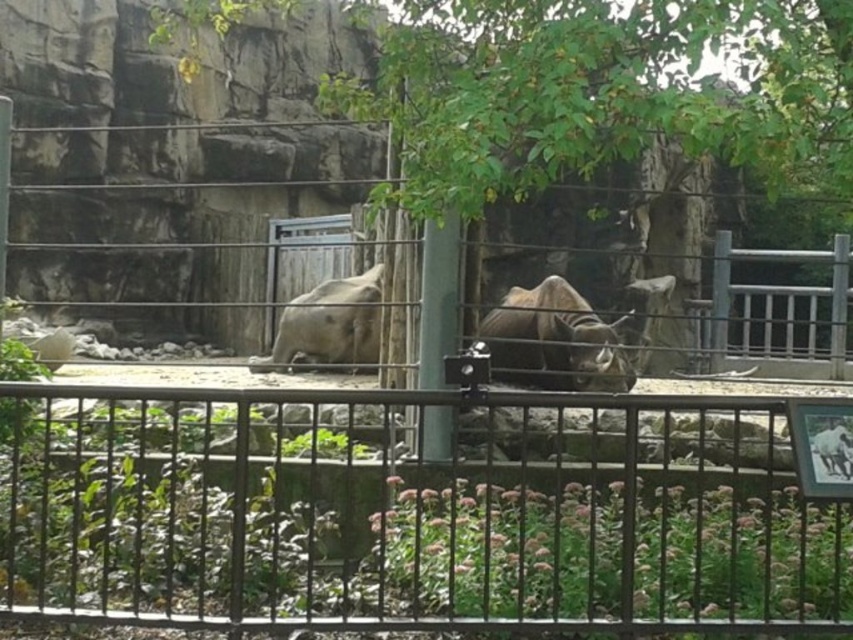
Question: Does brown textured rhino at center appear on the left side of gray matte rhino at center?

Choices:
 (A) yes
 (B) no

Answer: (B)

Question: Is green leafy tree at upper center positioned at the back of brown textured rhino at center?

Choices:
 (A) no
 (B) yes

Answer: (A)

Question: Which is nearer to the green leafy tree at upper center?

Choices:
 (A) gray matte rhino at center
 (B) metallic black fence at center

Answer: (B)

Question: Estimate the real-world distances between objects in this image. Which object is farther from the brown textured rhino at center?

Choices:
 (A) green leafy tree at upper center
 (B) gray matte rhino at center
 (C) metallic black fence at center

Answer: (A)

Question: Which object appears farthest from the camera in this image?

Choices:
 (A) metallic black fence at center
 (B) green leafy tree at upper center

Answer: (B)

Question: Is brown textured rhino at center to the left of gray matte rhino at center from the viewer's perspective?

Choices:
 (A) yes
 (B) no

Answer: (B)